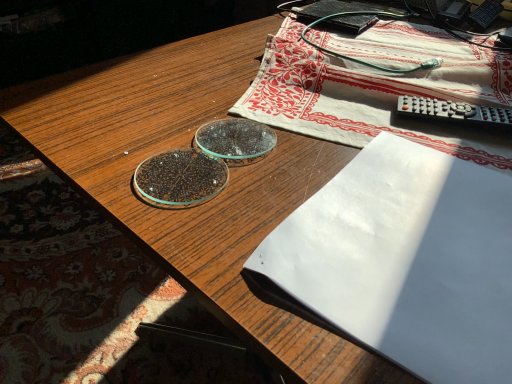
What is the approximate width of white paper at center?

The width of white paper at center is 12.28 inches.

In order to face white paper at center, should I rotate leftwards or rightwards?

It's best to rotate right around 23.046 degrees.

The height and width of the screenshot is (384, 512). Identify the location of black matte paperback book at upper right. (327, 9).

Describe the element at coordinates (379, 88) in the screenshot. I see `white cotton tablecloth at upper center` at that location.

You are a GUI agent. You are given a task and a screenshot of the screen. Output one action in this format:
    pyautogui.click(x=<x>, y=<y>)
    Task: Click on the white paper at center
    This screenshot has height=384, width=512.
    Given the screenshot: What is the action you would take?
    click(x=404, y=260)

Can you confirm if white paper at center is bigger than white cotton tablecloth at upper center?

Actually, white paper at center might be smaller than white cotton tablecloth at upper center.

How many degrees apart are the facing directions of white paper at center and white cotton tablecloth at upper center?

15.6 degrees separate the facing orientations of white paper at center and white cotton tablecloth at upper center.

Considering the sizes of objects white paper at center and white cotton tablecloth at upper center in the image provided, who is taller, white paper at center or white cotton tablecloth at upper center?

white cotton tablecloth at upper center.

Is black matte paperback book at upper right to the right of white paper at center from the viewer's perspective?

Yes, black matte paperback book at upper right is to the right of white paper at center.

From a real-world perspective, is black matte paperback book at upper right on white paper at center?

No.

Between black matte paperback book at upper right and white paper at center, which one has less height?

white paper at center.

Considering the sizes of objects white paper at center and black matte paperback book at upper right in the image provided, who is taller, white paper at center or black matte paperback book at upper right?

black matte paperback book at upper right.

Does white paper at center turn towards black matte paperback book at upper right?

No, white paper at center is not oriented towards black matte paperback book at upper right.

Considering the sizes of white paper at center and black matte paperback book at upper right in the image, is white paper at center bigger or smaller than black matte paperback book at upper right?

Clearly, white paper at center is smaller in size than black matte paperback book at upper right.

From the picture: Does white paper at center come behind black matte paperback book at upper right?

No, white paper at center is closer to the viewer.

Between white cotton tablecloth at upper center and white paper at center, which one appears on the left side from the viewer's perspective?

white paper at center is more to the left.

From the picture: Which of these two, white cotton tablecloth at upper center or white paper at center, stands shorter?

With less height is white paper at center.

Find the location of a particular element. notebook to the left of white cotton tablecloth at upper center is located at coordinates click(404, 260).

Considering the sizes of objects white cotton tablecloth at upper center and white paper at center in the image provided, who is smaller, white cotton tablecloth at upper center or white paper at center?

Smaller between the two is white paper at center.

Is black matte paperback book at upper right beside white cotton tablecloth at upper center?

No, black matte paperback book at upper right is not next to white cotton tablecloth at upper center.

From the picture: From the image's perspective, is black matte paperback book at upper right above white cotton tablecloth at upper center?

Correct, black matte paperback book at upper right appears higher than white cotton tablecloth at upper center in the image.

Is black matte paperback book at upper right oriented towards white cotton tablecloth at upper center?

Yes.

Can you confirm if black matte paperback book at upper right is smaller than white cotton tablecloth at upper center?

Yes.

Considering the points (439, 96) and (333, 29), which point is in front, point (439, 96) or point (333, 29)?

The point (439, 96) is more forward.

Which object is further away from the camera, white cotton tablecloth at upper center or black matte paperback book at upper right?

black matte paperback book at upper right is further away from the camera.

Where is `tablecloth on the right of black matte paperback book at upper right`? tablecloth on the right of black matte paperback book at upper right is located at coordinates (379, 88).

From the picture: Does white cotton tablecloth at upper center appear on the left side of black matte paperback book at upper right?

No, white cotton tablecloth at upper center is not to the left of black matte paperback book at upper right.

The width and height of the screenshot is (512, 384). Find the location of `tablecloth located above the white paper at center (from a real-world perspective)`. tablecloth located above the white paper at center (from a real-world perspective) is located at coordinates (379, 88).

Find the location of a particular element. Image resolution: width=512 pixels, height=384 pixels. paperback book on the right of white paper at center is located at coordinates (327, 9).

From the image, which object appears to be nearer to black matte paperback book at upper right, white cotton tablecloth at upper center or white paper at center?

white cotton tablecloth at upper center is closer to black matte paperback book at upper right.

Estimate the real-world distances between objects in this image. Which object is further from black matte paperback book at upper right, white paper at center or white cotton tablecloth at upper center?

Among the two, white paper at center is located further to black matte paperback book at upper right.

Based on their spatial positions, is white paper at center or black matte paperback book at upper right closer to white cotton tablecloth at upper center?

Among the two, black matte paperback book at upper right is located nearer to white cotton tablecloth at upper center.

Which object lies nearer to the anchor point white cotton tablecloth at upper center, black matte paperback book at upper right or white paper at center?

black matte paperback book at upper right is positioned closer to the anchor white cotton tablecloth at upper center.

When comparing their distances from white paper at center, does black matte paperback book at upper right or white cotton tablecloth at upper center seem further?

Based on the image, black matte paperback book at upper right appears to be further to white paper at center.

From the picture: Estimate the real-world distances between objects in this image. Which object is closer to white paper at center, white cotton tablecloth at upper center or black matte paperback book at upper right?

white cotton tablecloth at upper center is positioned closer to the anchor white paper at center.

Locate an element on the screen. tablecloth positioned between white paper at center and black matte paperback book at upper right from near to far is located at coordinates (379, 88).